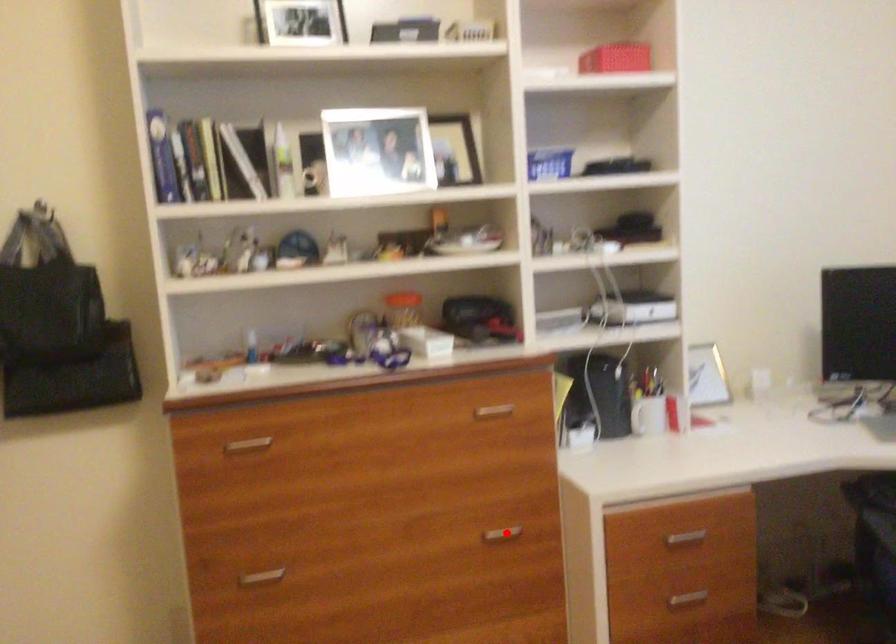
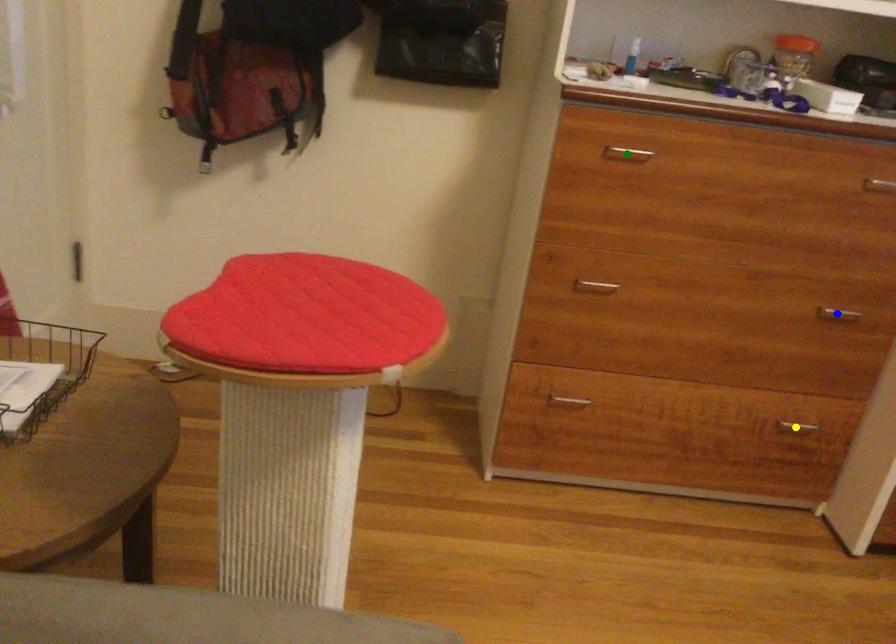
Question: I am providing you with two images of the same scene from different viewpoints. A red point is marked on the first image. You are given multiple points on the second image. Can you choose the point in image 2 that corresponds to the point in image 1?

Choices:
 (A) blue point
 (B) green point
 (C) yellow point

Answer: (A)